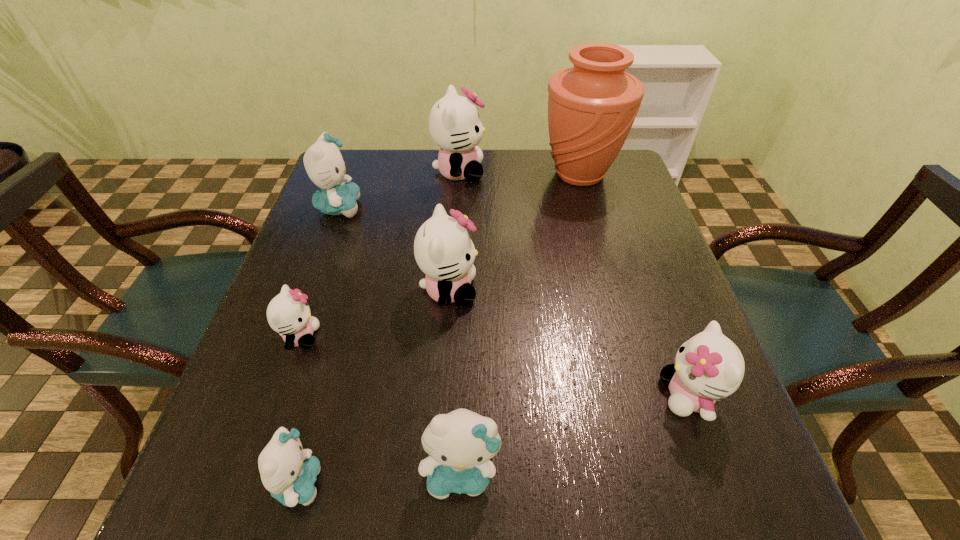
In order to click on the smallest blue kitten in this screenshot , I will do `click(288, 472)`.

Where is `free space located on the left of the tallest object`? The image size is (960, 540). free space located on the left of the tallest object is located at coordinates (452, 174).

Find the location of a particular element. Image resolution: width=960 pixels, height=540 pixels. vacant area located on the front-facing side of the seventh shortest object is located at coordinates 502,172.

Where is `vacant space situated 0.400m on the face of the farthest blue kitten`? This screenshot has height=540, width=960. vacant space situated 0.400m on the face of the farthest blue kitten is located at coordinates (514, 207).

Locate an element on the screen. free space located 0.400m on the front-facing side of the third smallest white kitten is located at coordinates (661, 290).

Locate an element on the screen. This screenshot has width=960, height=540. blank space located 0.130m on the front-facing side of the rightmost white kitten is located at coordinates (587, 395).

I want to click on vacant space situated on the front-facing side of the rightmost white kitten, so click(480, 395).

Locate an element on the screen. free location located 0.280m on the front-facing side of the rightmost white kitten is located at coordinates (502, 395).

This screenshot has width=960, height=540. Identify the location of vacant space situated on the front-facing side of the leftmost white kitten. (405, 336).

In order to click on blank space located on the face of the smallest blue kitten in this screenshot , I will do `click(478, 483)`.